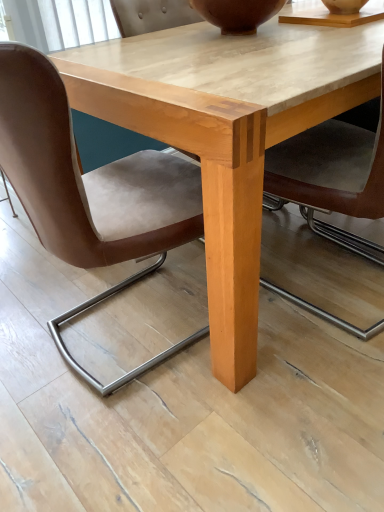
Question: From a real-world perspective, is brown matte vase at upper center physically located above or below light wood table at center?

Choices:
 (A) below
 (B) above

Answer: (B)

Question: Considering the positions of brown matte vase at upper center and light wood table at center in the image, is brown matte vase at upper center bigger or smaller than light wood table at center?

Choices:
 (A) big
 (B) small

Answer: (B)

Question: Estimate the real-world distances between objects in this image. Which object is closer to the light wood table at center?

Choices:
 (A) brown matte vase at upper center
 (B) brown leather chair at lower left

Answer: (B)

Question: Which is nearer to the light wood table at center?

Choices:
 (A) brown matte vase at upper center
 (B) brown leather chair at lower left

Answer: (B)